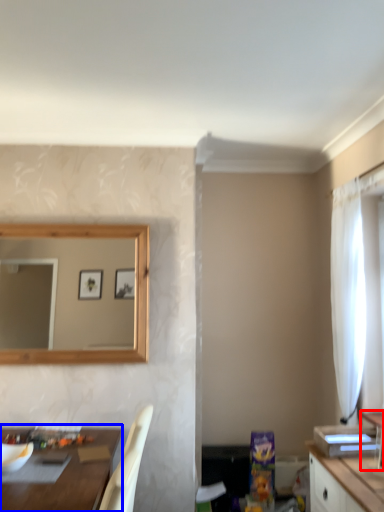
Question: Which object is closer to the camera taking this photo, vanity (highlighted by a red box) or table (highlighted by a blue box)?

Choices:
 (A) vanity
 (B) table

Answer: (B)